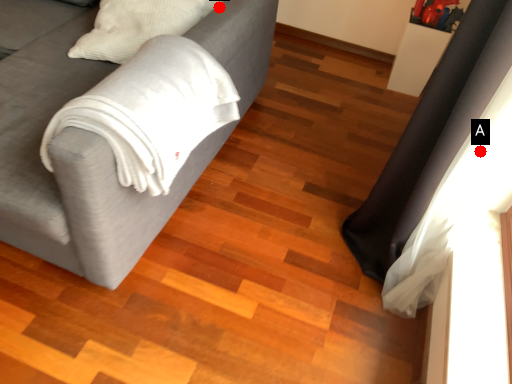
Question: Two points are circled on the image, labeled by A and B beside each circle. Which point appears farthest from the camera in this image?

Choices:
 (A) A is further
 (B) B is further

Answer: (B)